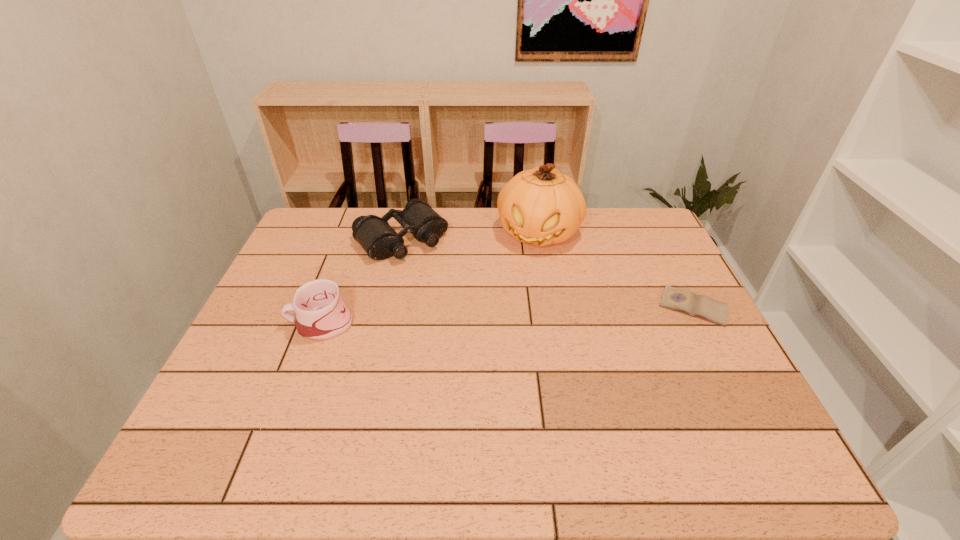
I want to click on vacant spot on the desktop that is between the mug and the rightmost object and is positioned through the eyepieces of the binoculars, so click(x=473, y=316).

Locate an element on the screen. The height and width of the screenshot is (540, 960). free spot on the desktop that is between the mug and the diary and is positioned on the front face of the tallest object is located at coordinates (511, 315).